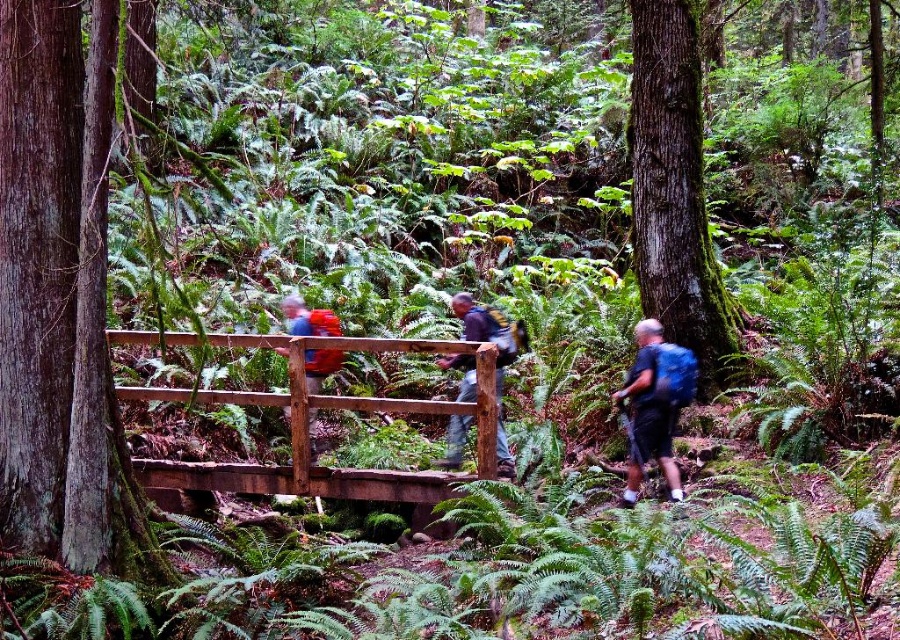
You are a hiker who wants to cross the brown wooden bridge at center while carrying your dark blue backpack at center. Will the bridge allow you to pass under it without removing the backpack?

The brown wooden bridge at center is not as tall as the dark blue backpack at center, meaning the bridge is shorter in height. Therefore, the bridge may not provide enough clearance for the backpack. You might need to remove the backpack to safely cross.

You are standing at the entrance of the forest and see the brown wooden bridge at center. If you want to reach the bridge, which direction should you move towards?

The brown wooden bridge at center is located at point coordinates, so you should move towards the center of the scene to reach it.